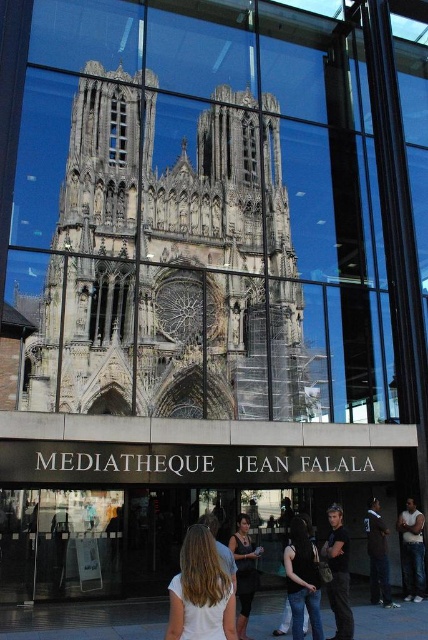
Question: Which point is closer to the camera taking this photo?

Choices:
 (A) click(x=115, y=106)
 (B) click(x=189, y=612)
 (C) click(x=288, y=593)
 (D) click(x=255, y=234)

Answer: (B)

Question: Which point appears closest to the camera in this image?

Choices:
 (A) (121, 140)
 (B) (312, 563)
 (C) (238, 518)
 (D) (205, 532)

Answer: (D)

Question: Does stone gothic cathedral at center appear under matte black tank top at center?

Choices:
 (A) no
 (B) yes

Answer: (A)

Question: Which object is farther from the camera taking this photo?

Choices:
 (A) blonde hair at center
 (B) matte black tank top at center

Answer: (B)

Question: Is matte black tank top at center below clear glass window at center?

Choices:
 (A) no
 (B) yes

Answer: (B)

Question: Is dark brown leather jacket at center positioned behind clear glass window at center?

Choices:
 (A) no
 (B) yes

Answer: (A)